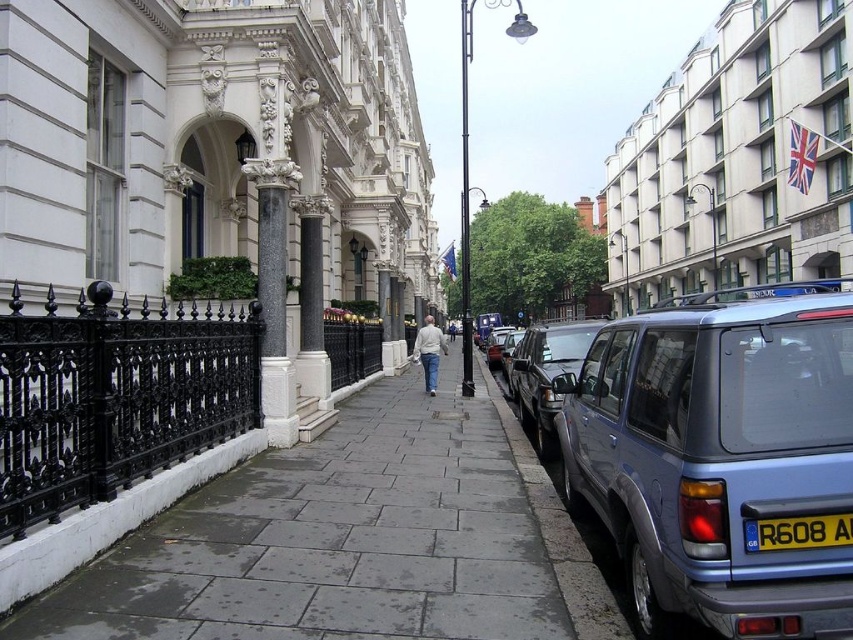
Question: Is light gray sweater at center to the left of metallic silver suv at center from the viewer's perspective?

Choices:
 (A) yes
 (B) no

Answer: (A)

Question: Does metallic blue minivan at right appear on the right side of gray concrete curb at lower right?

Choices:
 (A) no
 (B) yes

Answer: (B)

Question: Can you confirm if metallic blue minivan at right is positioned to the left of yellow matte license plate at center right?

Choices:
 (A) yes
 (B) no

Answer: (A)

Question: Which object is positioned closest to the metallic silver minivan at right?

Choices:
 (A) yellow matte license plate at center right
 (B) gray concrete curb at lower right
 (C) metallic blue minivan at right

Answer: (B)

Question: Among these objects, which one is farthest from the camera?

Choices:
 (A) metallic silver suv at center
 (B) black granite column at center
 (C) gray concrete curb at lower right

Answer: (A)

Question: Which point is farther to the camera?

Choices:
 (A) (494, 353)
 (B) (433, 376)

Answer: (A)